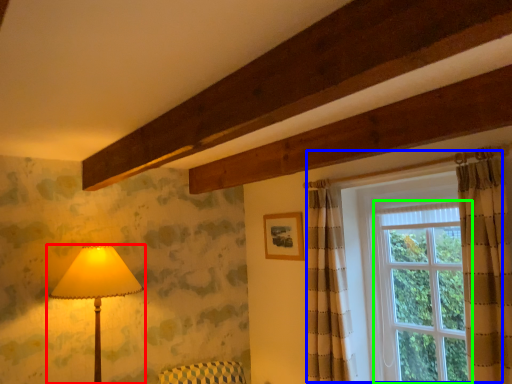
Question: Which object is positioned farthest from lamp (highlighted by a red box)? Select from window (highlighted by a blue box) and window (highlighted by a green box).

Choices:
 (A) window
 (B) window

Answer: (B)